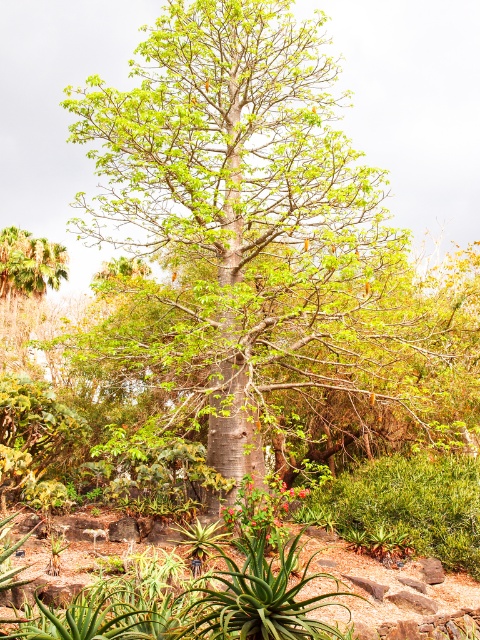
Question: Which object is positioned farthest from the smooth bark tree at center?

Choices:
 (A) bright red petals at center
 (B) bright red flower at center

Answer: (B)

Question: From the image, what is the correct spatial relationship of bright red petals at center in relation to bright red flower at center?

Choices:
 (A) left
 (B) right

Answer: (A)

Question: Among these objects, which one is farthest from the camera?

Choices:
 (A) smooth bark tree at center
 (B) bright red flower at center
 (C) bright red petals at center

Answer: (B)

Question: Can you confirm if smooth bark tree at center is positioned to the left of bright red flower at center?

Choices:
 (A) no
 (B) yes

Answer: (B)

Question: Which of the following is the closest to the observer?

Choices:
 (A) smooth bark tree at center
 (B) bright red flower at center
 (C) bright red petals at center

Answer: (A)

Question: Does smooth bark tree at center lie behind bright red flower at center?

Choices:
 (A) yes
 (B) no

Answer: (B)